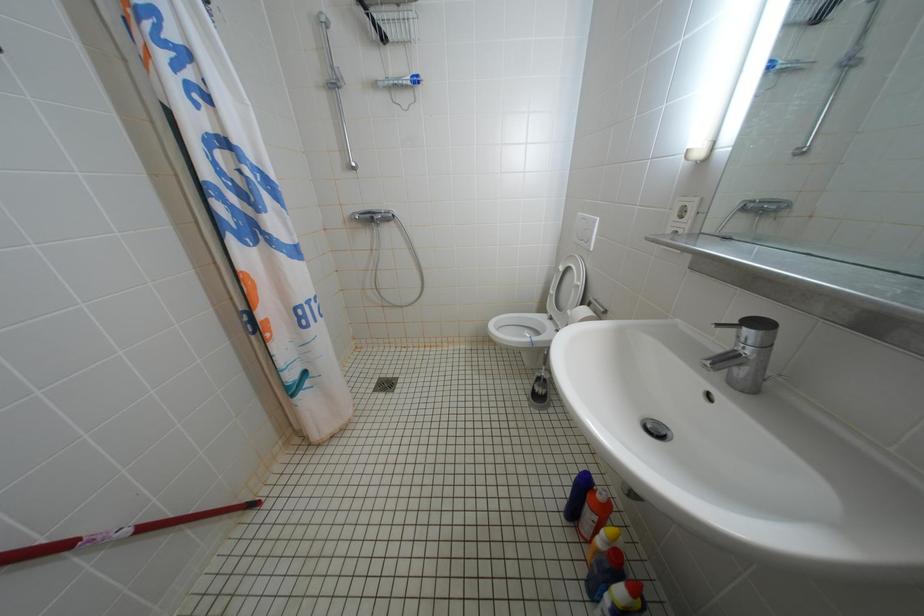
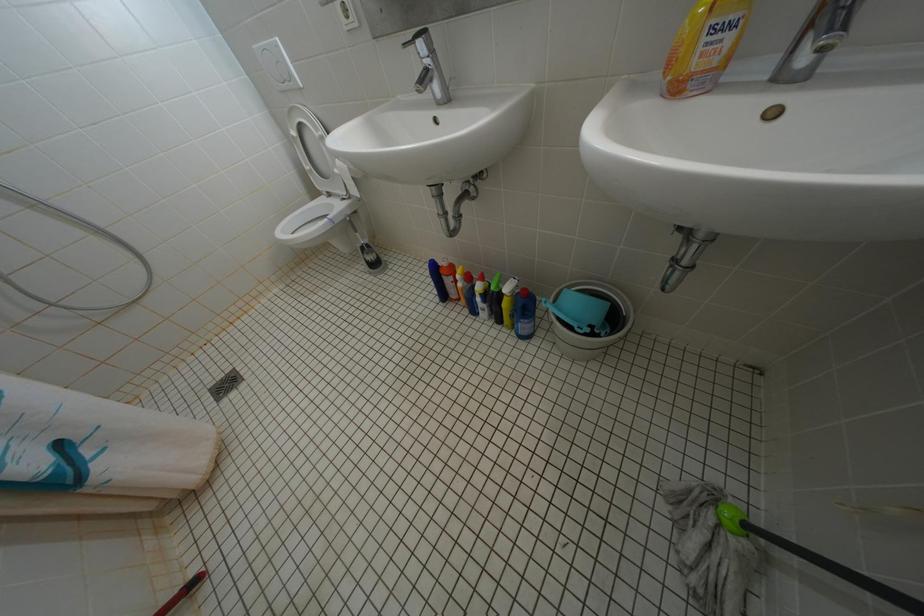
The first image is from the beginning of the video and the second image is from the end. How did the camera likely rotate when shooting the video?

The camera's rotation is toward right-down.